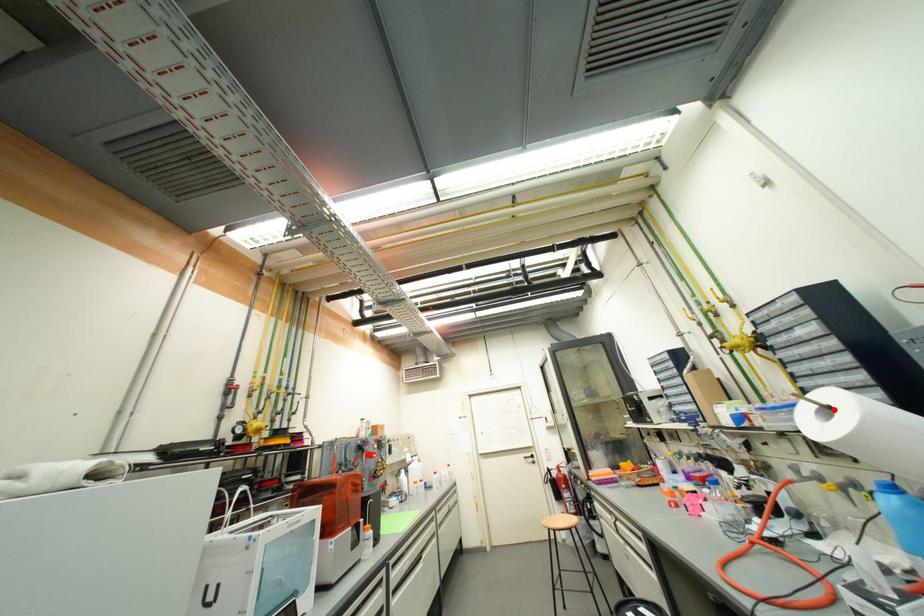
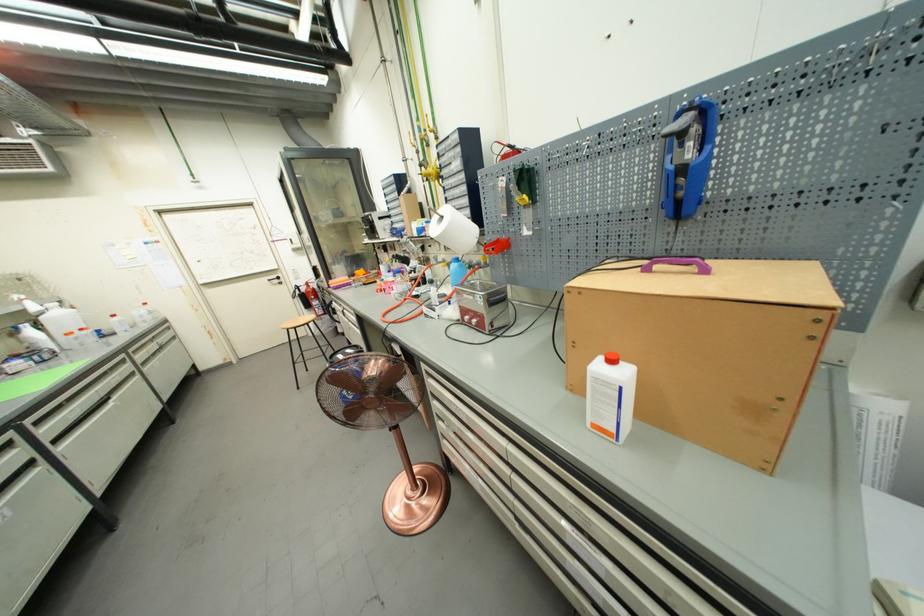
Find the pixel in the second image that matches the highlighted location in the first image.

(447, 219)